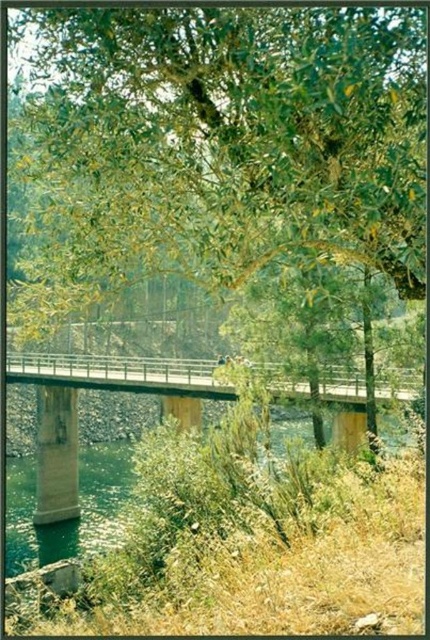
Question: In this image, where is green leafy tree at center located relative to metallic gray bridge at center?

Choices:
 (A) right
 (B) left

Answer: (A)

Question: Among these objects, which one is farthest from the camera?

Choices:
 (A) metallic gray bridge at center
 (B) green leafy tree at center

Answer: (A)

Question: Is green leafy tree at center positioned in front of metallic gray bridge at center?

Choices:
 (A) yes
 (B) no

Answer: (A)

Question: Which object appears closest to the camera in this image?

Choices:
 (A) green leafy tree at center
 (B) metallic gray bridge at center

Answer: (A)

Question: Can you confirm if green leafy tree at center is smaller than metallic gray bridge at center?

Choices:
 (A) yes
 (B) no

Answer: (A)